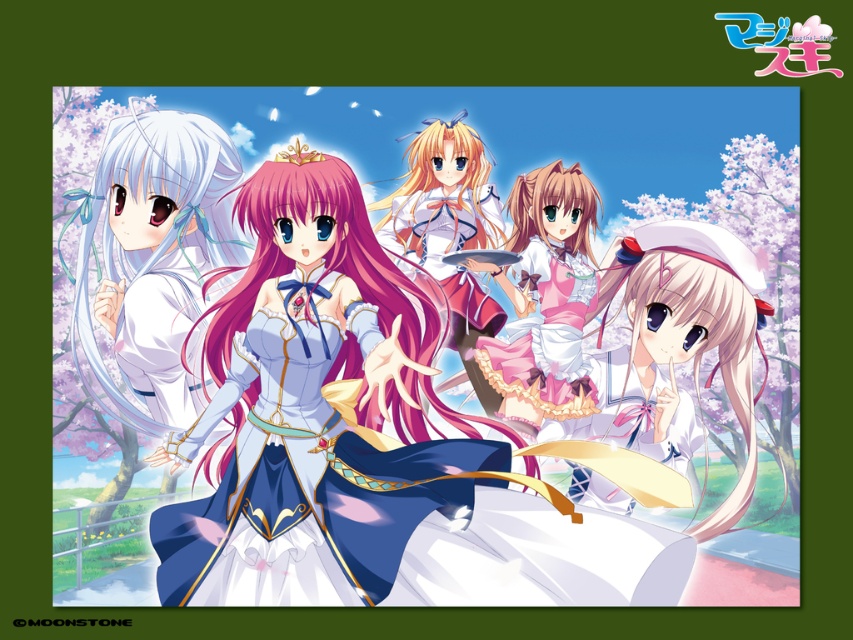
Question: Is satin white dress at center smaller than pink satin dress at center?

Choices:
 (A) no
 (B) yes

Answer: (A)

Question: Is pastel pink fabric dress at center wider than smooth pink dress at center?

Choices:
 (A) no
 (B) yes

Answer: (B)

Question: Estimate the real-world distances between objects in this image. Which object is closer to the satin white dress at center?

Choices:
 (A) pastel pink fabric dress at center
 (B) pink satin dress at center

Answer: (A)

Question: Does pastel pink fabric dress at center appear over pink satin dress at center?

Choices:
 (A) yes
 (B) no

Answer: (B)

Question: Which point is farther to the camera?

Choices:
 (A) (448, 180)
 (B) (577, 376)

Answer: (A)

Question: Which object is farther from the camera taking this photo?

Choices:
 (A) satin white dress at left
 (B) pastel pink fabric dress at center
 (C) satin white dress at center
 (D) smooth pink dress at center

Answer: (B)